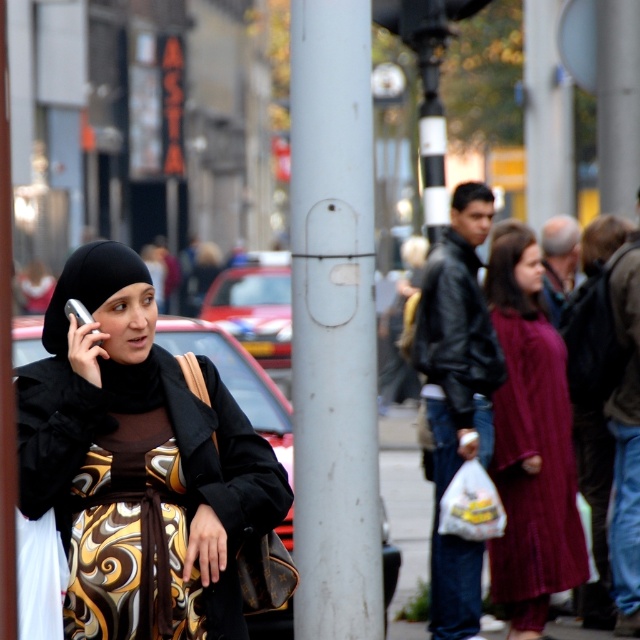
You are a photographer who wants to capture the maroon textured dress at center in the image. The camera you are using has a limited field of view and can only focus on objects within a 0.5 unit radius from the point specified. Would the point at coordinates point [531,442] be suitable to focus on to ensure the dress is fully visible?

The point [531,442] is on the maroon textured dress at center, so focusing at this point would ensure the dress is within the camera focus area.

You are standing in the middle of the urban street scene and want to determine which of the two points, point (323, 410) or point (148, 515), is closer to you. Based on the scene description, which point is nearer?

Point (323, 410) is further to the viewer than point (148, 515). Therefore, point (148, 515) is closer to you.

You are a photographer trying to capture the gold patterned dress at center without the white matte pole at center blocking the view. Is it possible to adjust your position to achieve this?

The white matte pole at center is further to the viewer than the gold patterned dress at center, so moving your position to the side could allow you to see the gold patterned dress at center without the pole blocking the view.